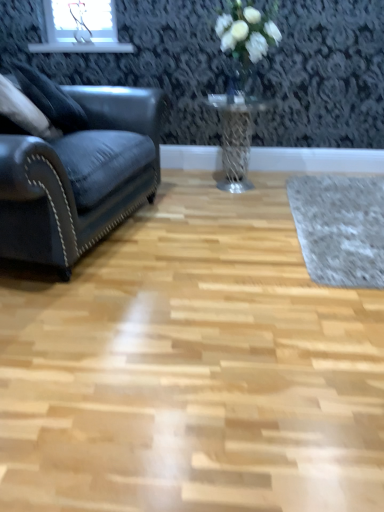
Question: From a real-world perspective, is metallic mesh table at center on top of gray woolen mat at right?

Choices:
 (A) no
 (B) yes

Answer: (B)

Question: Are metallic mesh table at center and gray woolen mat at right beside each other?

Choices:
 (A) no
 (B) yes

Answer: (A)

Question: Is metallic mesh table at center facing towards gray woolen mat at right?

Choices:
 (A) yes
 (B) no

Answer: (B)

Question: From the image's perspective, is metallic mesh table at center beneath gray woolen mat at right?

Choices:
 (A) yes
 (B) no

Answer: (B)

Question: Considering the relative sizes of metallic mesh table at center and gray woolen mat at right in the image provided, is metallic mesh table at center smaller than gray woolen mat at right?

Choices:
 (A) no
 (B) yes

Answer: (A)

Question: Is metallic mesh table at center far from gray woolen mat at right?

Choices:
 (A) no
 (B) yes

Answer: (A)

Question: Considering the relative positions of metallic mesh table at center and clear glass vase at upper center in the image provided, is metallic mesh table at center to the right of clear glass vase at upper center from the viewer's perspective?

Choices:
 (A) no
 (B) yes

Answer: (A)

Question: Considering the relative positions of metallic mesh table at center and clear glass vase at upper center in the image provided, is metallic mesh table at center behind clear glass vase at upper center?

Choices:
 (A) no
 (B) yes

Answer: (B)

Question: From the image's perspective, does metallic mesh table at center appear higher than clear glass vase at upper center?

Choices:
 (A) no
 (B) yes

Answer: (A)

Question: Is metallic mesh table at center thinner than clear glass vase at upper center?

Choices:
 (A) yes
 (B) no

Answer: (B)

Question: Could you tell me if metallic mesh table at center is facing clear glass vase at upper center?

Choices:
 (A) no
 (B) yes

Answer: (A)

Question: Is metallic mesh table at center to the left of clear glass vase at upper center from the viewer's perspective?

Choices:
 (A) yes
 (B) no

Answer: (A)

Question: From a real-world perspective, is gray woolen mat at right under clear glass vase at upper center?

Choices:
 (A) no
 (B) yes

Answer: (B)